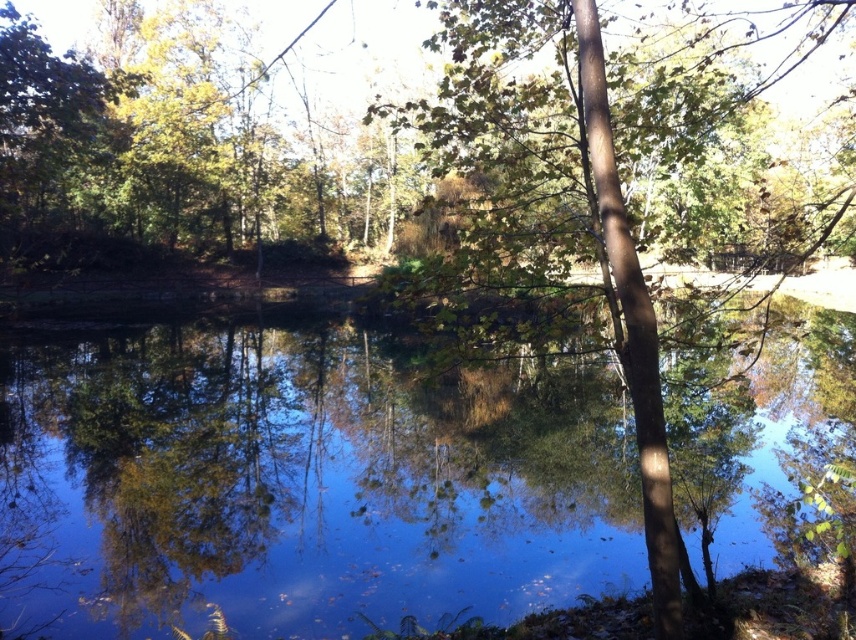
You are standing in the serene natural scene and want to take a photo of both the transparent water at center and the green matte tree at center. Which object will appear smaller in your photo?

The transparent water at center will appear smaller in the photo because it has a lesser height compared to the green matte tree at center.

You are an artist trying to paint the scene. You want to ensure the transparent water at center and the green matte tree at center are proportionally accurate. Which object should you make larger in your painting?

The green matte tree at center should be made larger since it occupies more space than the transparent water at center according to the description.